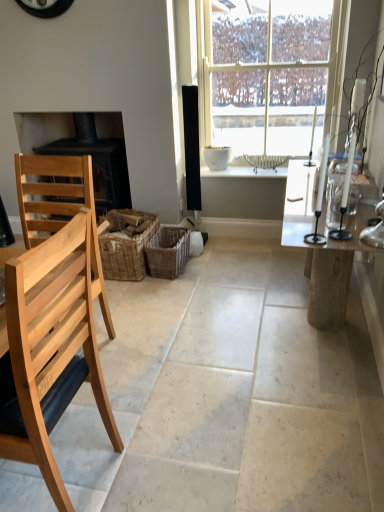
The height and width of the screenshot is (512, 384). Identify the location of free point below clear glass table at right (from a real-world perspective). (301, 311).